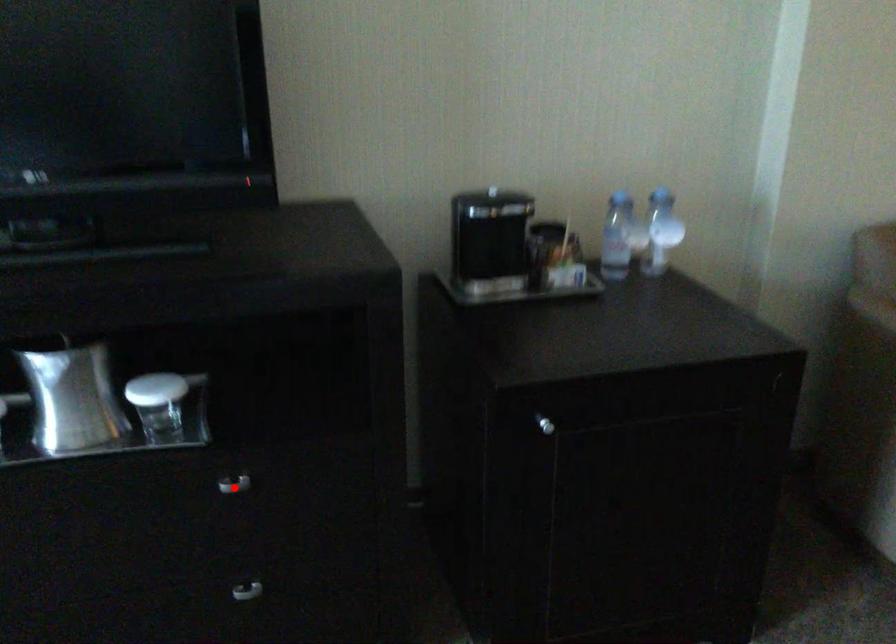
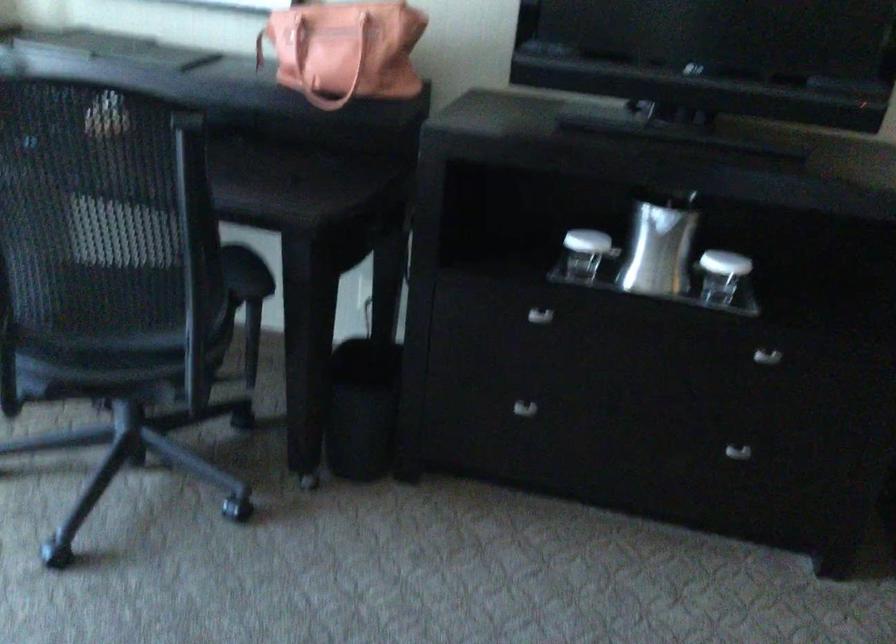
Question: I am providing you with two images of the same scene from different viewpoints. A red point is marked on the first image. Can you still see the location of the red point in image 2?

Choices:
 (A) Yes
 (B) No

Answer: (A)